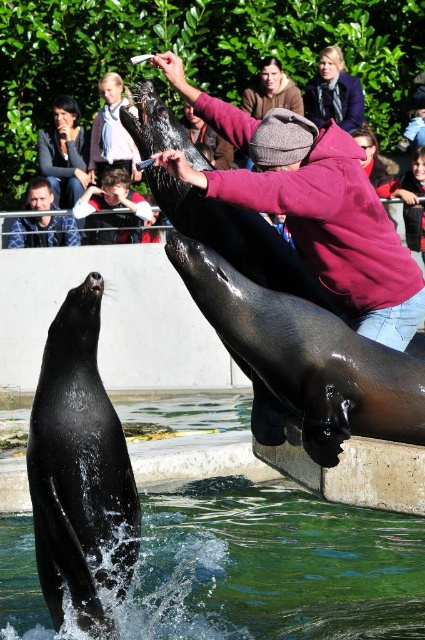
Question: Among these points, which one is farthest from the camera?

Choices:
 (A) (x=124, y=161)
 (B) (x=45, y=164)
 (C) (x=172, y=605)
 (D) (x=337, y=61)

Answer: (B)

Question: From the image, what is the correct spatial relationship of green liquid water at seal front in relation to dark brown hair at upper left?

Choices:
 (A) right
 (B) left

Answer: (A)

Question: Is dark blue woolen coat at upper center wider than light blue scarf at upper center?

Choices:
 (A) no
 (B) yes

Answer: (B)

Question: In this image, where is green liquid water at seal front located relative to light blue scarf at upper center?

Choices:
 (A) right
 (B) left

Answer: (A)

Question: Among these points, which one is farthest from the camera?

Choices:
 (A) (93, 177)
 (B) (241, 508)
 (C) (90, 380)
 (D) (357, 77)

Answer: (A)

Question: Which is nearer to the shiny black seal at center?

Choices:
 (A) dark brown hair at upper left
 (B) green liquid water at seal front
 (C) light blue scarf at upper center

Answer: (B)